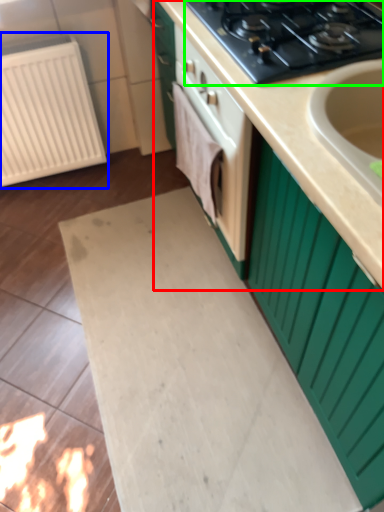
Question: Which object is positioned closest to countertop (highlighted by a red box)? Select from radiator (highlighted by a blue box) and gas stove (highlighted by a green box).

Choices:
 (A) radiator
 (B) gas stove

Answer: (B)